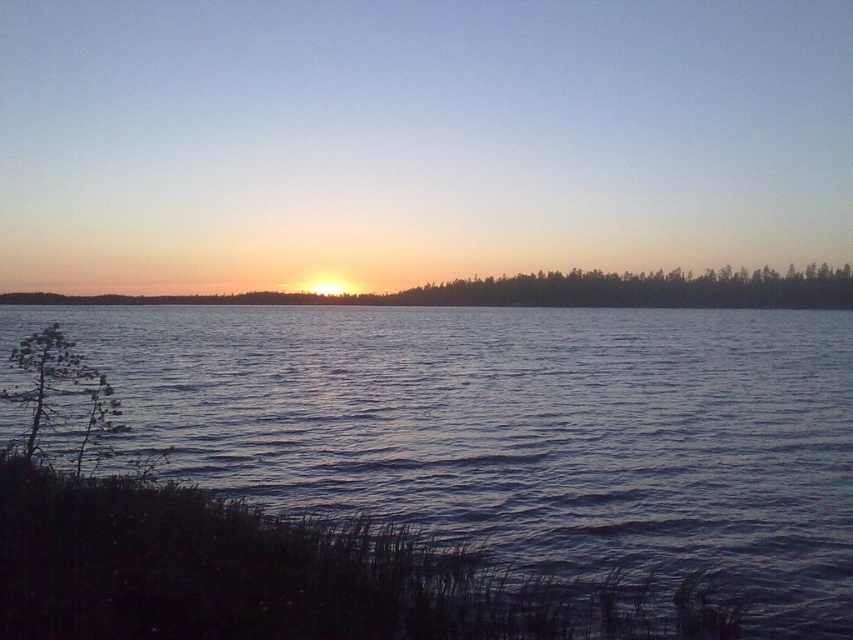
The height and width of the screenshot is (640, 853). What do you see at coordinates (415, 140) in the screenshot?
I see `orange sky at horizon` at bounding box center [415, 140].

Is orange sky at horizon thinner than dark blue water at center?

No, orange sky at horizon is not thinner than dark blue water at center.

Between point (732, 176) and point (811, 564), which one is positioned behind?

Positioned behind is point (732, 176).

Find the location of a particular element. The image size is (853, 640). orange sky at horizon is located at coordinates (415, 140).

Between dark blue water at center and green matte tree at center, which one has less height?

Standing shorter between the two is dark blue water at center.

What do you see at coordinates (514, 419) in the screenshot? I see `dark blue water at center` at bounding box center [514, 419].

Where is `dark blue water at center`? dark blue water at center is located at coordinates (514, 419).

Locate an element on the screen. This screenshot has height=640, width=853. dark blue water at center is located at coordinates (514, 419).

The width and height of the screenshot is (853, 640). Identify the location of dark blue water at center. (514, 419).

Does dark blue water at center have a greater width compared to green matte tree at lower left?

Indeed, dark blue water at center has a greater width compared to green matte tree at lower left.

Where is `dark blue water at center`? The width and height of the screenshot is (853, 640). dark blue water at center is located at coordinates (514, 419).